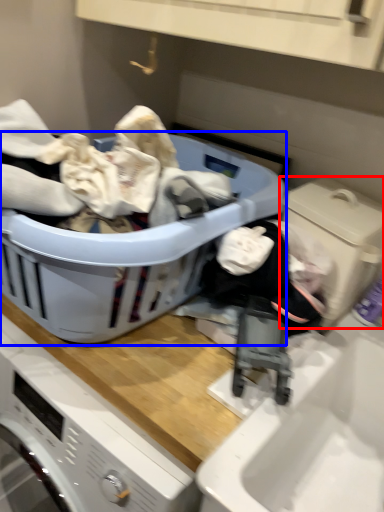
Question: Which of the following is the farthest to the observer, washing machine (highlighted by a red box) or laundry basket (highlighted by a blue box)?

Choices:
 (A) washing machine
 (B) laundry basket

Answer: (A)